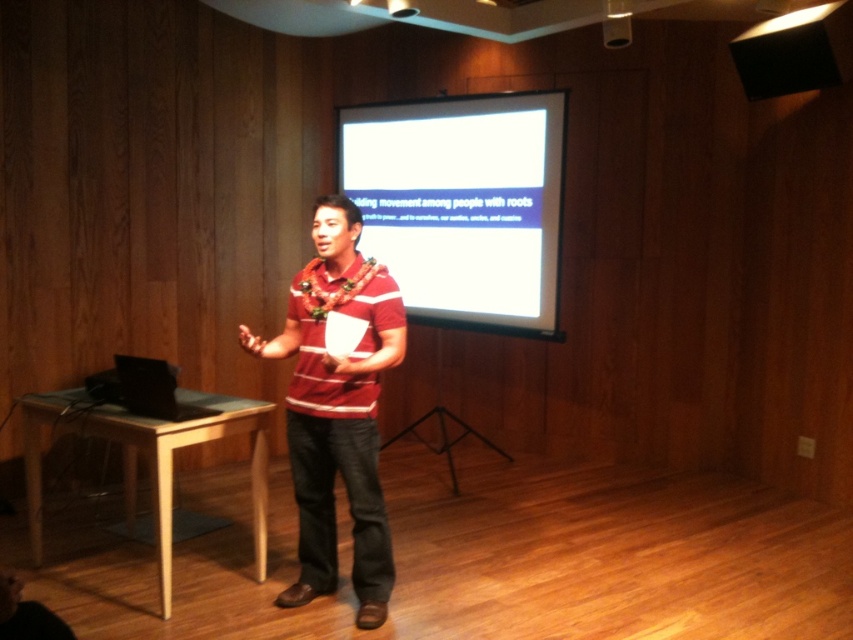
Question: Does matte red striped shirt at center have a larger size compared to matte black speaker at upper right?

Choices:
 (A) no
 (B) yes

Answer: (B)

Question: Is white glossy projection screen at upper center to the right of matte black speaker at upper right from the viewer's perspective?

Choices:
 (A) no
 (B) yes

Answer: (A)

Question: Which object is farther from the camera taking this photo?

Choices:
 (A) matte red striped shirt at center
 (B) white glossy projection screen at upper center
 (C) matte black speaker at upper right

Answer: (B)

Question: Which of the following is the closest to the observer?

Choices:
 (A) (383, 348)
 (B) (503, 272)
 (C) (782, 92)

Answer: (A)

Question: Which point is farther from the camera taking this photo?

Choices:
 (A) (399, 179)
 (B) (373, 499)

Answer: (A)

Question: Observing the image, what is the correct spatial positioning of matte red striped shirt at center in reference to matte black speaker at upper right?

Choices:
 (A) below
 (B) above

Answer: (A)